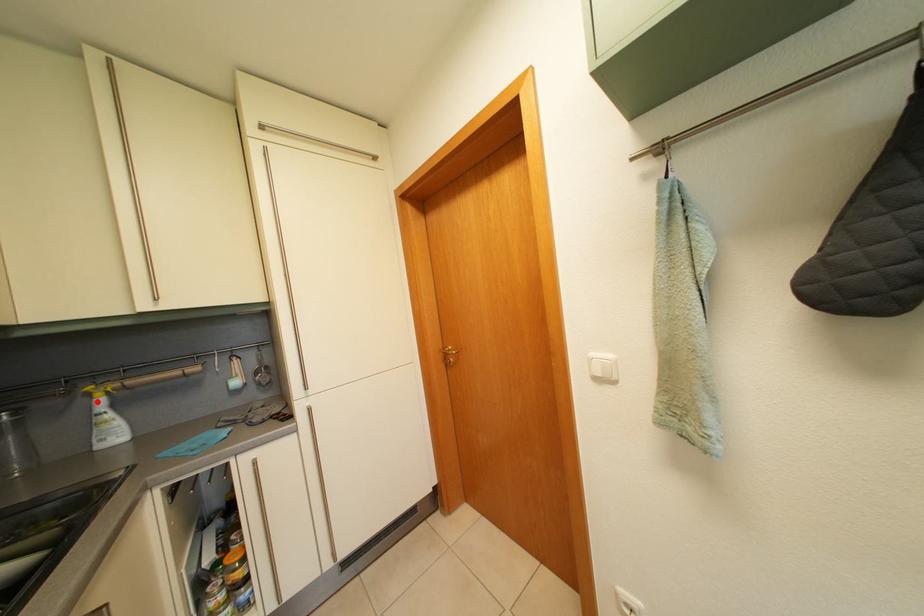
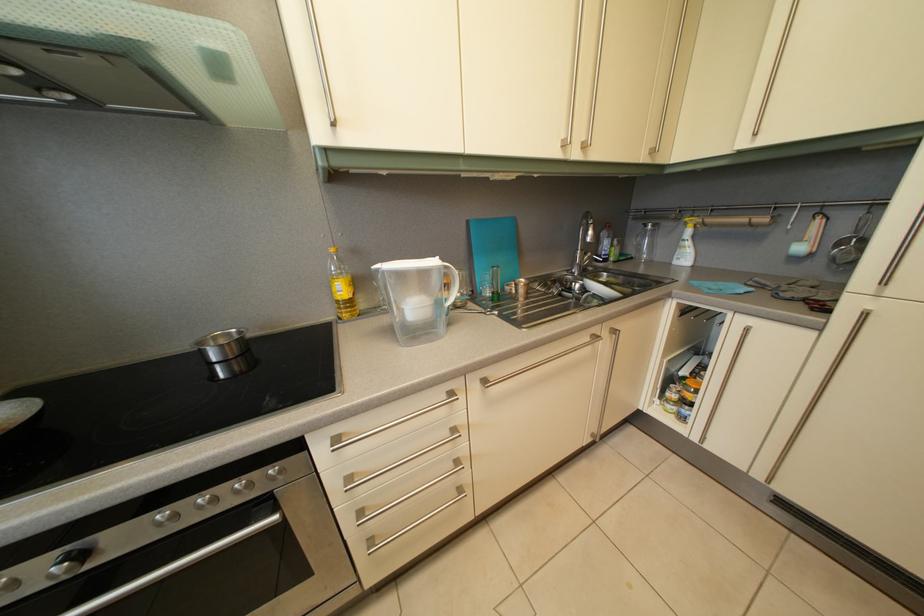
Question: I am providing you with two images of the same scene from different viewpoints. A red point is marked on the first image. At the location where the point appears in image 1, is it still visible in image 2?

Choices:
 (A) Yes
 (B) No

Answer: (A)